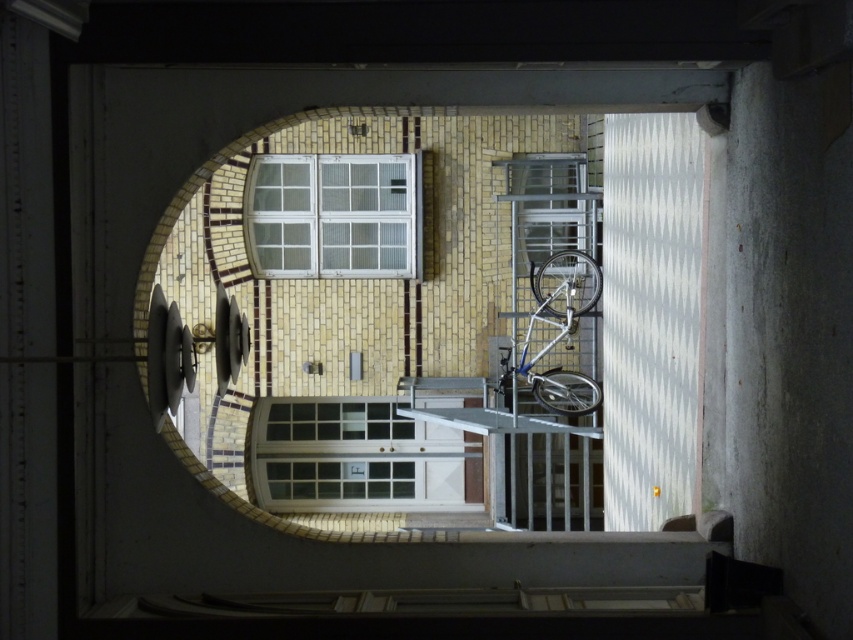
Question: Is white glass door at center smaller than white glass window at upper center?

Choices:
 (A) no
 (B) yes

Answer: (A)

Question: Which of the following is the farthest from the observer?

Choices:
 (A) white glass door at center
 (B) white glass window at upper center

Answer: (A)

Question: From the image, what is the correct spatial relationship of yellow brick archway at center in relation to white glass window at upper center?

Choices:
 (A) right
 (B) left

Answer: (A)

Question: Among these objects, which one is nearest to the camera?

Choices:
 (A) white glass window at upper center
 (B) silver metallic bicycle at center

Answer: (B)

Question: Which object is farther from the camera taking this photo?

Choices:
 (A) white glass window at upper center
 (B) silver metallic bicycle at center

Answer: (A)

Question: Observing the image, what is the correct spatial positioning of white glass window at upper center in reference to silver metallic bicycle at center?

Choices:
 (A) above
 (B) below

Answer: (A)